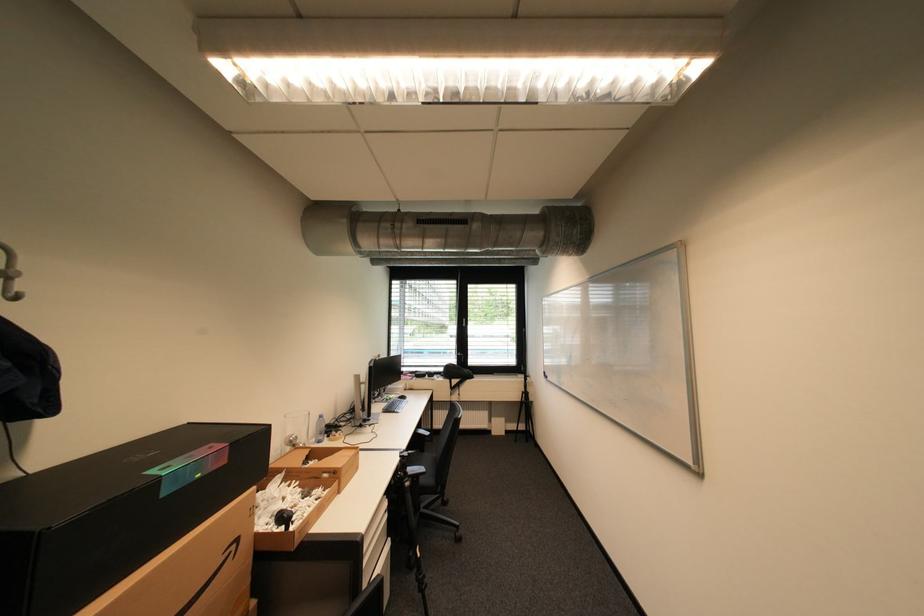
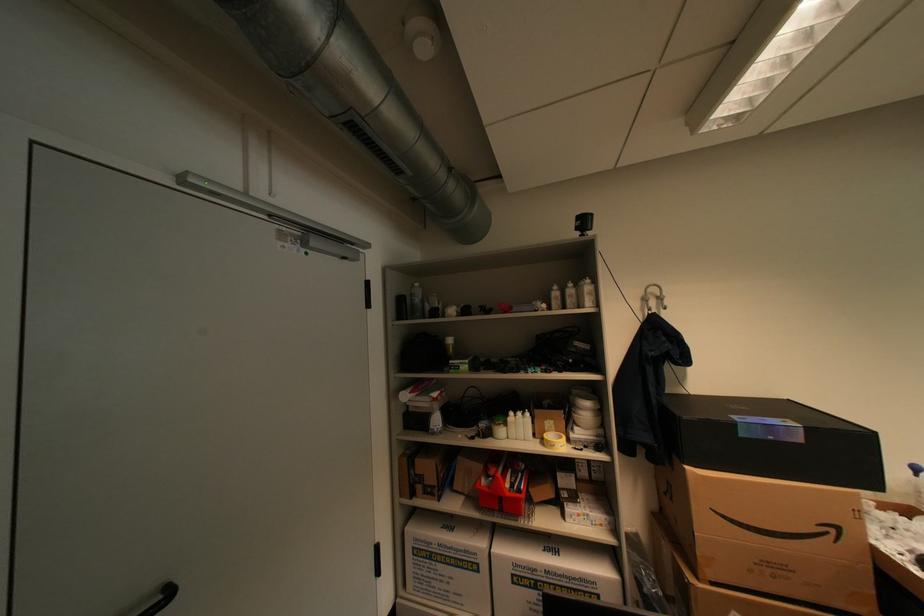
Where in the second image is the point corresponding to the point at 242,546 from the first image?

(841, 531)